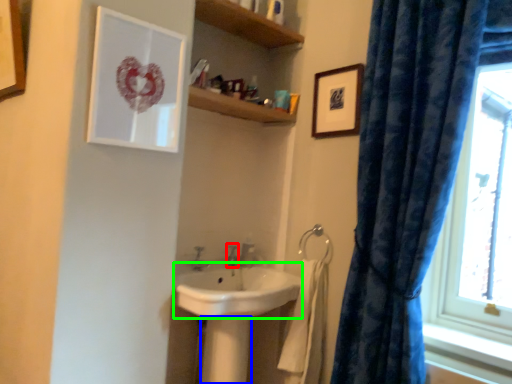
Question: Which object is the closest to the plumbing fixture (highlighted by a red box)? Choose among these: pillar (highlighted by a blue box) or sink (highlighted by a green box).

Choices:
 (A) pillar
 (B) sink

Answer: (B)